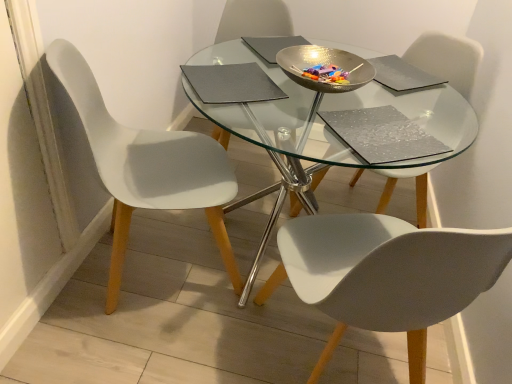
What is the approximate height of hammered metal bowl at center?

hammered metal bowl at center is 3.22 inches in height.

What is the approximate width of white matte chair at center, the 1th chair from the right?

The width of white matte chair at center, the 1th chair from the right, is 52.91 centimeters.

The width and height of the screenshot is (512, 384). Identify the location of white matte chair at center, the second chair positioned from the left. (385, 271).

The height and width of the screenshot is (384, 512). What are the coordinates of `white matte chair at left, which is the 1th chair in left-to-right order` in the screenshot? It's located at (147, 166).

At what (x,y) coordinates should I click in order to perform the action: click on silver textured pad at center, the fourth pad positioned from the top. Please return your answer as a coordinate pair (x, y). The height and width of the screenshot is (384, 512). Looking at the image, I should click on (382, 134).

Can you tell me how much transparent glass table at center and matte gray pad at upper right, acting as the third pad starting from the bottom, differ in facing direction?

There is a 130-degree angle between the facing directions of transparent glass table at center and matte gray pad at upper right, acting as the third pad starting from the bottom.

Is transparent glass table at center spatially inside matte gray pad at upper right, which is counted as the second pad, starting from the top, or outside of it?

transparent glass table at center lies outside matte gray pad at upper right, which is counted as the second pad, starting from the top.

Does point (333, 160) appear closer or farther from the camera than point (405, 88)?

Point (333, 160) appears to be closer to the viewer than point (405, 88).

Locate an element on the screen. This screenshot has width=512, height=384. bowl located above the white matte chair at center, which appears as the third chair when viewed from the left (from the image's perspective) is located at coordinates (325, 68).

How many degrees apart are the facing directions of white matte chair at center, the 1th chair from the right, and hammered metal bowl at center?

The angular difference between white matte chair at center, the 1th chair from the right, and hammered metal bowl at center is 44.9 degrees.

From a real-world perspective, which is physically below, white matte chair at center, which appears as the third chair when viewed from the left, or hammered metal bowl at center?

white matte chair at center, which appears as the third chair when viewed from the left, is physically lower.

Considering the relative positions of matte gray pad at center, the third pad viewed from the top, and transparent glass table at center in the image provided, is matte gray pad at center, the third pad viewed from the top, behind transparent glass table at center?

Yes, it is.

Is matte gray pad at center, the third pad viewed from the top, not close to transparent glass table at center?

No, matte gray pad at center, the third pad viewed from the top, is in close proximity to transparent glass table at center.

Where is `table that is under the matte gray pad at center, which is counted as the second pad, starting from the bottom (from a real-world perspective)`? This screenshot has width=512, height=384. table that is under the matte gray pad at center, which is counted as the second pad, starting from the bottom (from a real-world perspective) is located at coordinates pyautogui.click(x=323, y=123).

From the image's perspective, does matte gray pad at center, the third pad viewed from the top, appear higher than transparent glass table at center?

Correct, matte gray pad at center, the third pad viewed from the top, appears higher than transparent glass table at center in the image.

From a real-world perspective, is matte gray pad at upper right, which is counted as the second pad, starting from the top, beneath matte gray pad at upper center, positioned as the 4th pad in bottom-to-top order?

Indeed, from a real-world perspective, matte gray pad at upper right, which is counted as the second pad, starting from the top, is positioned beneath matte gray pad at upper center, positioned as the 4th pad in bottom-to-top order.

Which point is more forward, (383, 68) or (291, 40)?

The point (383, 68) is more forward.

Is matte gray pad at upper right, acting as the third pad starting from the bottom, to the left of matte gray pad at upper center, which is the first pad from top to bottom, from the viewer's perspective?

In fact, matte gray pad at upper right, acting as the third pad starting from the bottom, is to the right of matte gray pad at upper center, which is the first pad from top to bottom.

Is matte gray pad at upper right, which is counted as the second pad, starting from the top, turned away from matte gray pad at upper center, positioned as the 4th pad in bottom-to-top order?

matte gray pad at upper right, which is counted as the second pad, starting from the top, does not have its back to matte gray pad at upper center, positioned as the 4th pad in bottom-to-top order.

Is matte gray pad at upper center, which is the first pad from top to bottom, wider or thinner than matte gray pad at center, the third pad viewed from the top?

matte gray pad at upper center, which is the first pad from top to bottom, is thinner than matte gray pad at center, the third pad viewed from the top.

Is matte gray pad at upper center, positioned as the 4th pad in bottom-to-top order, taller than matte gray pad at center, which is counted as the second pad, starting from the bottom?

No, matte gray pad at upper center, positioned as the 4th pad in bottom-to-top order, is not taller than matte gray pad at center, which is counted as the second pad, starting from the bottom.

Is matte gray pad at upper center, positioned as the 4th pad in bottom-to-top order, turned away from matte gray pad at center, the third pad viewed from the top?

No.

Which pad is the 2nd one when counting from the back of the matte gray pad at center, which is counted as the second pad, starting from the bottom? Please provide its 2D coordinates.

[(272, 45)]

Is white matte chair at center, which ranks as the second chair in right-to-left order, further to the viewer compared to white matte chair at center, the 1th chair from the right?

No, it is in front of white matte chair at center, the 1th chair from the right.

Based on their positions, is white matte chair at center, which ranks as the second chair in right-to-left order, located to the left or right of white matte chair at center, the 1th chair from the right?

Clearly, white matte chair at center, which ranks as the second chair in right-to-left order, is on the left of white matte chair at center, the 1th chair from the right, in the image.

Can you confirm if white matte chair at center, which ranks as the second chair in right-to-left order, is taller than white matte chair at center, which appears as the third chair when viewed from the left?

No.

Is the position of matte gray pad at center, which is counted as the second pad, starting from the bottom, more distant than that of matte gray pad at upper right, acting as the third pad starting from the bottom?

No, the depth of matte gray pad at center, which is counted as the second pad, starting from the bottom, is less than that of matte gray pad at upper right, acting as the third pad starting from the bottom.

Is matte gray pad at center, which is counted as the second pad, starting from the bottom, in contact with matte gray pad at upper right, which is counted as the second pad, starting from the top?

No, matte gray pad at center, which is counted as the second pad, starting from the bottom, is not beside matte gray pad at upper right, which is counted as the second pad, starting from the top.

Can you confirm if matte gray pad at center, which is counted as the second pad, starting from the bottom, is shorter than matte gray pad at upper right, which is counted as the second pad, starting from the top?

Incorrect, the height of matte gray pad at center, which is counted as the second pad, starting from the bottom, does not fall short of that of matte gray pad at upper right, which is counted as the second pad, starting from the top.

Do you think matte gray pad at center, the third pad viewed from the top, is within matte gray pad at upper right, acting as the third pad starting from the bottom, or outside of it?

matte gray pad at center, the third pad viewed from the top, exists outside the volume of matte gray pad at upper right, acting as the third pad starting from the bottom.

Where is `table on the left of matte gray pad at upper right, acting as the third pad starting from the bottom`? The width and height of the screenshot is (512, 384). table on the left of matte gray pad at upper right, acting as the third pad starting from the bottom is located at coordinates (323, 123).

The image size is (512, 384). Identify the location of bowl located above the white matte chair at center, the 1th chair from the right (from a real-world perspective). 325,68.

Estimate the real-world distances between objects in this image. Which object is closer to transparent glass table at center, matte gray pad at upper right, which is counted as the second pad, starting from the top, or white matte chair at left, which is the 1th chair in left-to-right order?

matte gray pad at upper right, which is counted as the second pad, starting from the top, lies closer to transparent glass table at center than the other object.

Considering their positions, is white matte chair at center, which appears as the third chair when viewed from the left, positioned closer to transparent glass table at center than silver textured pad at center, the fourth pad positioned from the top?

silver textured pad at center, the fourth pad positioned from the top, lies closer to transparent glass table at center than the other object.

In the scene shown: Which object lies nearer to the anchor point white matte chair at center, the second chair positioned from the left, matte gray pad at upper center, positioned as the 4th pad in bottom-to-top order, or silver textured pad at center, the fourth pad positioned from the top?

Among the two, silver textured pad at center, the fourth pad positioned from the top, is located nearer to white matte chair at center, the second chair positioned from the left.

Considering their positions, is white matte chair at left, which is the 1th chair in left-to-right order, positioned further to hammered metal bowl at center than transparent glass table at center?

white matte chair at left, which is the 1th chair in left-to-right order, is further to hammered metal bowl at center.

Estimate the real-world distances between objects in this image. Which object is closer to matte gray pad at upper right, which is counted as the second pad, starting from the top, white matte chair at center, the second chair positioned from the left, or white matte chair at center, the 1th chair from the right?

white matte chair at center, the 1th chair from the right, is positioned closer to the anchor matte gray pad at upper right, which is counted as the second pad, starting from the top.

Looking at the image, which one is located further to matte gray pad at upper right, acting as the third pad starting from the bottom, hammered metal bowl at center or silver textured pad at center, placed as the first pad when sorted from bottom to top?

The object further to matte gray pad at upper right, acting as the third pad starting from the bottom, is silver textured pad at center, placed as the first pad when sorted from bottom to top.

From the image, which object appears to be farther from matte gray pad at center, the third pad viewed from the top, transparent glass table at center or silver textured pad at center, the fourth pad positioned from the top?

transparent glass table at center lies further to matte gray pad at center, the third pad viewed from the top, than the other object.

Estimate the real-world distances between objects in this image. Which object is further from hammered metal bowl at center, white matte chair at center, the second chair positioned from the left, or matte gray pad at upper right, which is counted as the second pad, starting from the top?

white matte chair at center, the second chair positioned from the left, is positioned further to the anchor hammered metal bowl at center.

You are a GUI agent. You are given a task and a screenshot of the screen. Output one action in this format:
    pyautogui.click(x=<x>, y=<y>)
    Task: Click on the table between white matte chair at left, acting as the third chair starting from the right, and silver textured pad at center, placed as the first pad when sorted from bottom to top, in the horizontal direction
    This screenshot has height=384, width=512.
    Given the screenshot: What is the action you would take?
    pyautogui.click(x=323, y=123)

The width and height of the screenshot is (512, 384). What are the coordinates of `chair located between white matte chair at left, which is the 1th chair in left-to-right order, and white matte chair at center, the 1th chair from the right, in the left-right direction` in the screenshot? It's located at (385, 271).

Identify the location of bowl between white matte chair at left, which is the 1th chair in left-to-right order, and white matte chair at center, the second chair positioned from the left, in the horizontal direction. (325, 68).

Where is `table positioned between white matte chair at center, the second chair positioned from the left, and matte gray pad at upper right, which is counted as the second pad, starting from the top, from near to far`? table positioned between white matte chair at center, the second chair positioned from the left, and matte gray pad at upper right, which is counted as the second pad, starting from the top, from near to far is located at coordinates (323, 123).